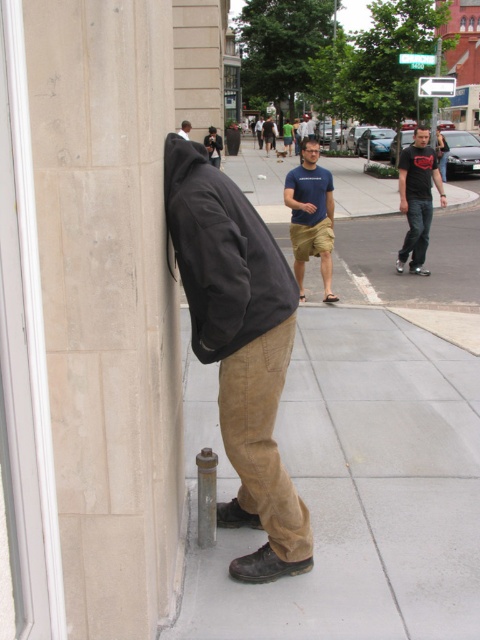
You are an observer standing on the sidewalk looking at the scene. You notice two objects labeled as black matte jacket at left and black matte jacket at upper left. Which of these two objects takes up more area in the image?

The black matte jacket at upper left takes up more area in the image than the black matte jacket at left because it occupies more space according to the description.